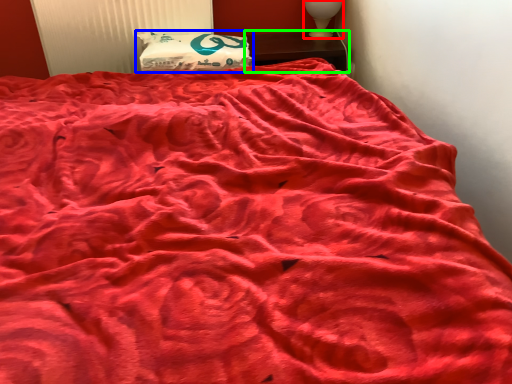
Question: Considering the real-world distances, which object is farthest from table lamp (highlighted by a red box)? pillow (highlighted by a blue box) or furniture (highlighted by a green box)?

Choices:
 (A) pillow
 (B) furniture

Answer: (A)